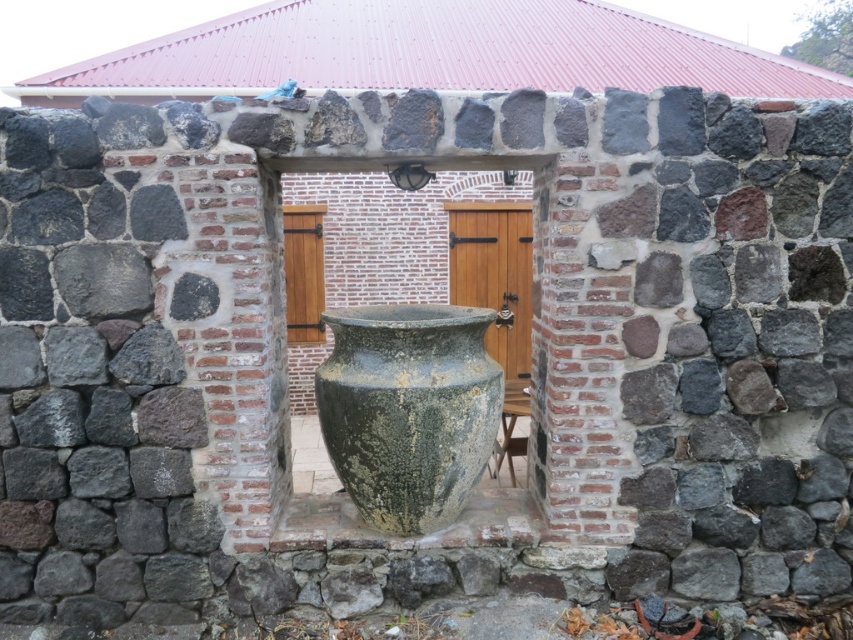
Question: Is green mossy stone vase at center to the right of wooden stool at center from the viewer's perspective?

Choices:
 (A) yes
 (B) no

Answer: (B)

Question: Which point appears closest to the camera in this image?

Choices:
 (A) (361, 320)
 (B) (527, 396)

Answer: (A)

Question: Can you confirm if green mossy stone vase at center is positioned to the right of wooden stool at center?

Choices:
 (A) no
 (B) yes

Answer: (A)

Question: Does green mossy stone vase at center appear on the right side of wooden stool at center?

Choices:
 (A) no
 (B) yes

Answer: (A)